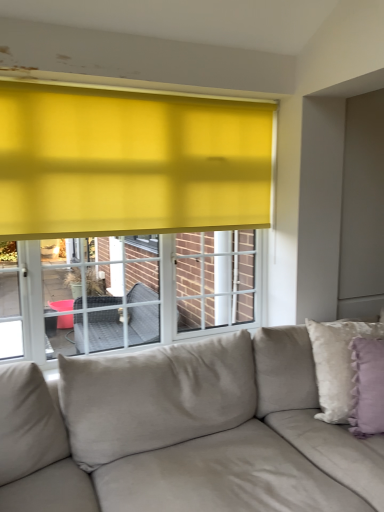
Question: Is suede-like beige couch at lower center wider than lavender velvet pillow at right, placed as the 2th pillow when sorted from back to front?

Choices:
 (A) no
 (B) yes

Answer: (B)

Question: Is suede-like beige couch at lower center not inside lavender velvet pillow at right, placed as the 2th pillow when sorted from back to front?

Choices:
 (A) no
 (B) yes

Answer: (B)

Question: Would you say suede-like beige couch at lower center contains lavender velvet pillow at right, placed as the 2th pillow when sorted from back to front?

Choices:
 (A) no
 (B) yes

Answer: (B)

Question: From the image's perspective, would you say suede-like beige couch at lower center is positioned over lavender velvet pillow at right, which appears as the 1th pillow when viewed from the front?

Choices:
 (A) no
 (B) yes

Answer: (A)

Question: Is suede-like beige couch at lower center positioned before lavender velvet pillow at right, placed as the 2th pillow when sorted from back to front?

Choices:
 (A) no
 (B) yes

Answer: (B)

Question: Is lavender velvet pillow at right, placed as the 2th pillow when sorted from back to front, at the back of suede-like beige couch at lower center?

Choices:
 (A) no
 (B) yes

Answer: (B)

Question: Does fluffy white pillow at right, which ranks as the 2th pillow in front-to-back order, turn towards lavender velvet pillow at right, placed as the 2th pillow when sorted from back to front?

Choices:
 (A) yes
 (B) no

Answer: (A)

Question: Can you confirm if fluffy white pillow at right, the 1th pillow positioned from the back, is wider than lavender velvet pillow at right, placed as the 2th pillow when sorted from back to front?

Choices:
 (A) yes
 (B) no

Answer: (A)

Question: Does fluffy white pillow at right, which ranks as the 2th pillow in front-to-back order, have a lesser height compared to lavender velvet pillow at right, which appears as the 1th pillow when viewed from the front?

Choices:
 (A) yes
 (B) no

Answer: (B)

Question: Considering the relative positions of fluffy white pillow at right, the 1th pillow positioned from the back, and lavender velvet pillow at right, which appears as the 1th pillow when viewed from the front, in the image provided, is fluffy white pillow at right, the 1th pillow positioned from the back, to the left of lavender velvet pillow at right, which appears as the 1th pillow when viewed from the front, from the viewer's perspective?

Choices:
 (A) no
 (B) yes

Answer: (B)

Question: Considering the relative sizes of fluffy white pillow at right, which ranks as the 2th pillow in front-to-back order, and lavender velvet pillow at right, placed as the 2th pillow when sorted from back to front, in the image provided, is fluffy white pillow at right, which ranks as the 2th pillow in front-to-back order, bigger than lavender velvet pillow at right, placed as the 2th pillow when sorted from back to front,?

Choices:
 (A) no
 (B) yes

Answer: (B)

Question: From a real-world perspective, is fluffy white pillow at right, the 1th pillow positioned from the back, over lavender velvet pillow at right, placed as the 2th pillow when sorted from back to front?

Choices:
 (A) no
 (B) yes

Answer: (A)

Question: Is suede-like beige couch at lower center at the back of lavender velvet pillow at right, placed as the 2th pillow when sorted from back to front?

Choices:
 (A) yes
 (B) no

Answer: (A)